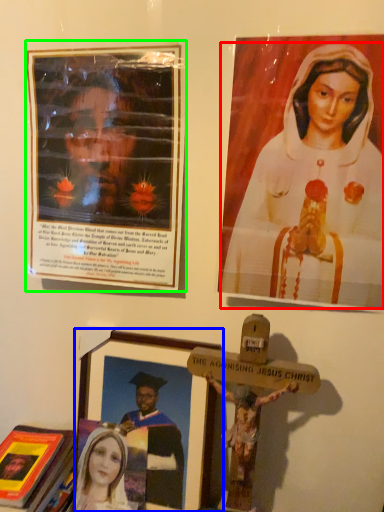
Question: Considering the real-world distances, which object is farthest from woman (highlighted by a red box)? picture frame (highlighted by a blue box) or picture frame (highlighted by a green box)?

Choices:
 (A) picture frame
 (B) picture frame

Answer: (A)